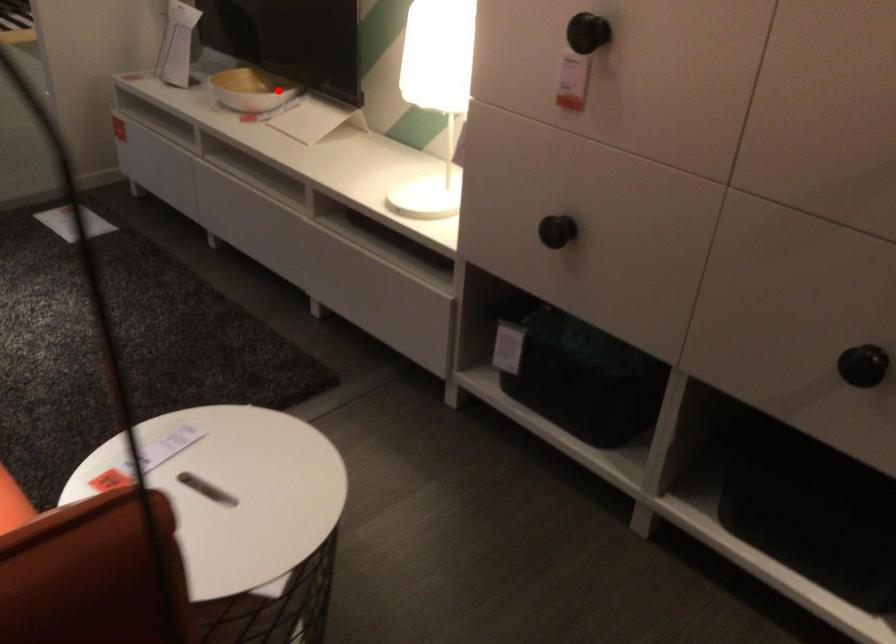
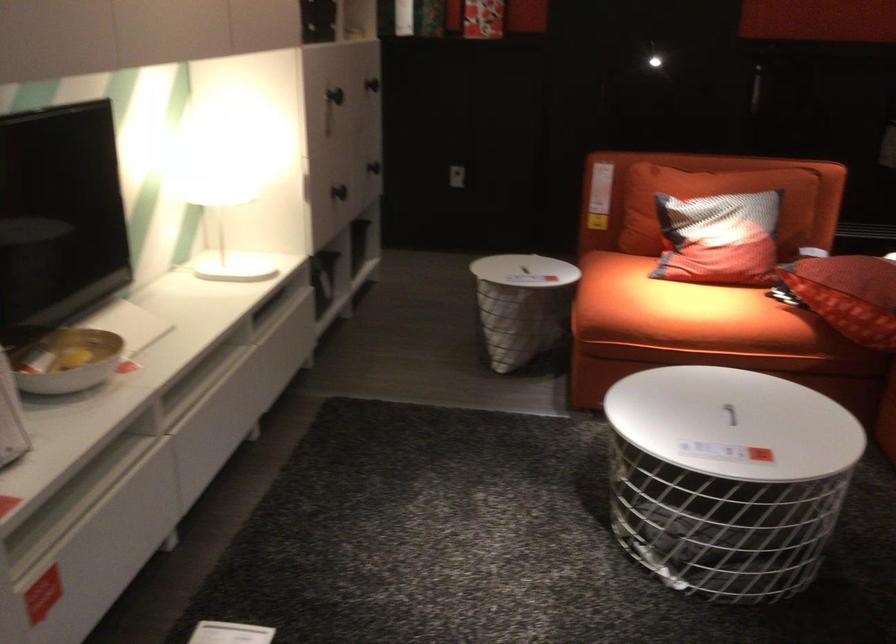
Question: I am providing you with two images of the same scene from different viewpoints. Given a red point in image1, look at the same physical point in image2. Is it:

Choices:
 (A) Closer to the viewpoint
 (B) Farther from the viewpoint

Answer: (A)